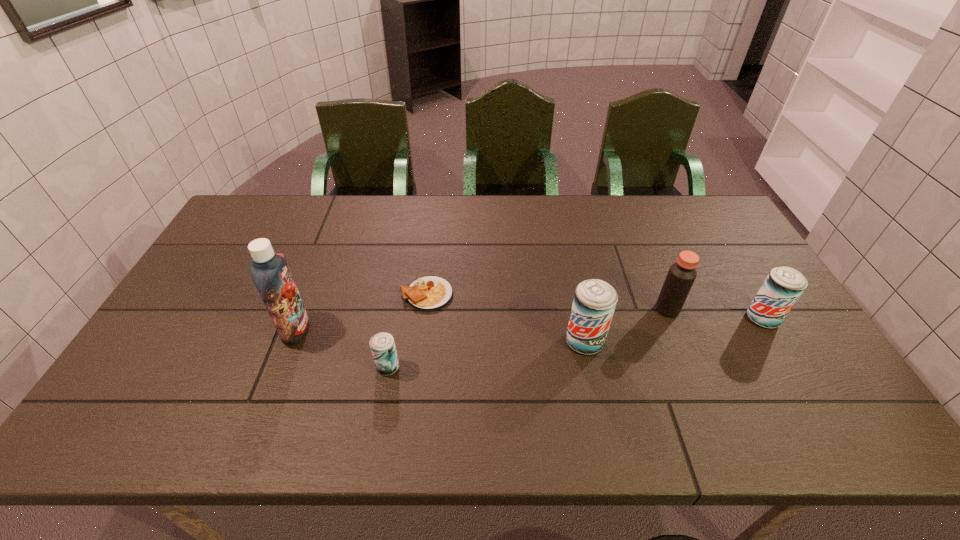
This screenshot has height=540, width=960. I want to click on free space located 0.180m on the left of the second beer can from left to right, so click(497, 342).

Where is `vacant position located 0.390m on the left of the fourth tallest object`? The height and width of the screenshot is (540, 960). vacant position located 0.390m on the left of the fourth tallest object is located at coordinates (606, 319).

Where is `vacant space located 0.240m on the front label of the shampoo`? This screenshot has height=540, width=960. vacant space located 0.240m on the front label of the shampoo is located at coordinates (398, 329).

The height and width of the screenshot is (540, 960). Identify the location of vacant space located on the right of the omelet. (556, 294).

Where is `free location located on the left of the vinegar`? The image size is (960, 540). free location located on the left of the vinegar is located at coordinates (637, 309).

The width and height of the screenshot is (960, 540). What are the coordinates of `object located at the near edge` in the screenshot? It's located at (382, 344).

Locate an element on the screen. The height and width of the screenshot is (540, 960). object at the right edge is located at coordinates (783, 286).

Locate an element on the screen. This screenshot has width=960, height=540. vacant space at the far edge of the desktop is located at coordinates (354, 219).

This screenshot has height=540, width=960. In order to click on free space at the near edge of the desktop in this screenshot , I will do `click(386, 399)`.

In the image, there is a desktop. At what (x,y) coordinates should I click in order to perform the action: click on vacant space at the left edge. Please return your answer as a coordinate pair (x, y). This screenshot has height=540, width=960. Looking at the image, I should click on (180, 312).